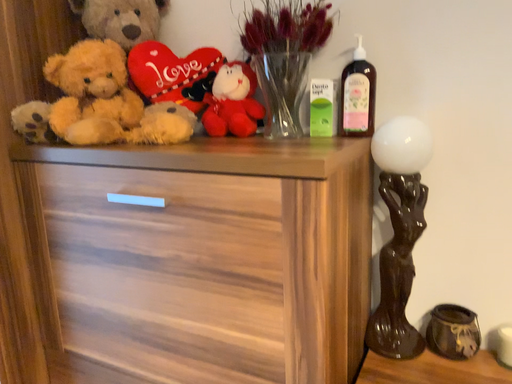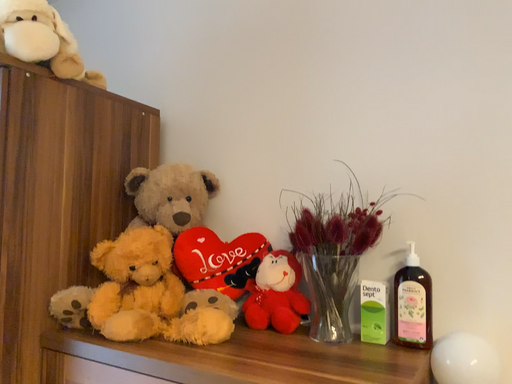
Question: Which way did the camera rotate in the video?

Choices:
 (A) rotated upward
 (B) rotated downward

Answer: (A)